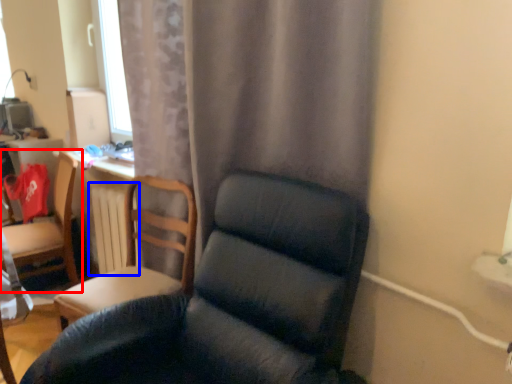
Question: Which object is further to the camera taking this photo, chair (highlighted by a red box) or radiator (highlighted by a blue box)?

Choices:
 (A) chair
 (B) radiator

Answer: (A)